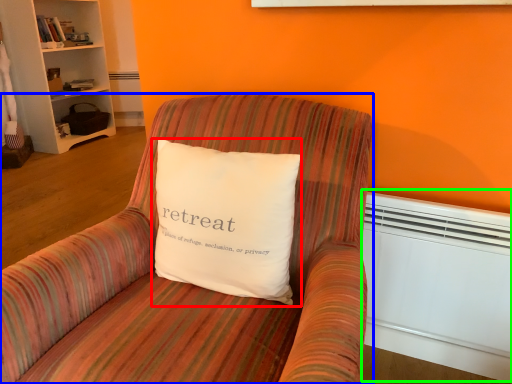
Question: Which object is the closest to the pillow (highlighted by a red box)? Choose among these: chair (highlighted by a blue box) or heater (highlighted by a green box).

Choices:
 (A) chair
 (B) heater

Answer: (A)